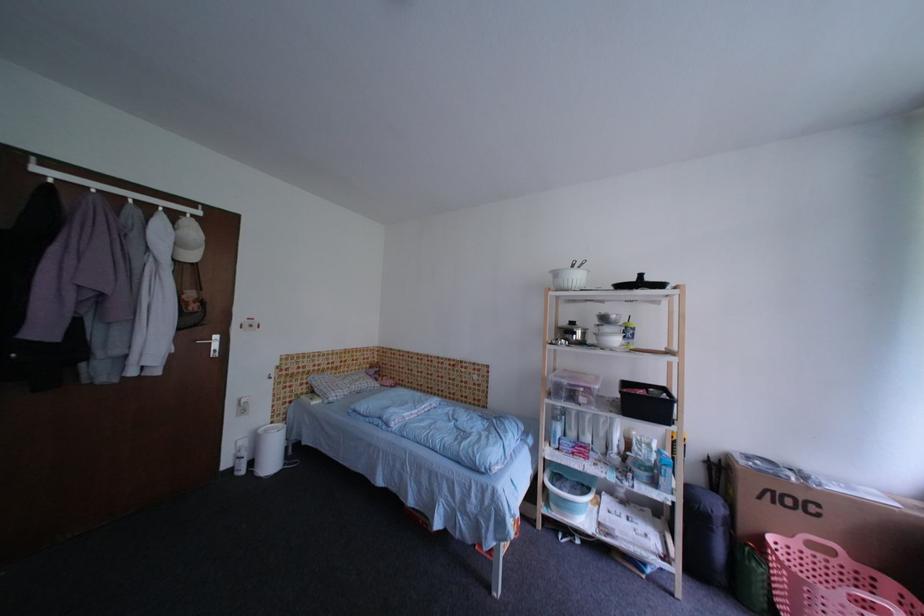
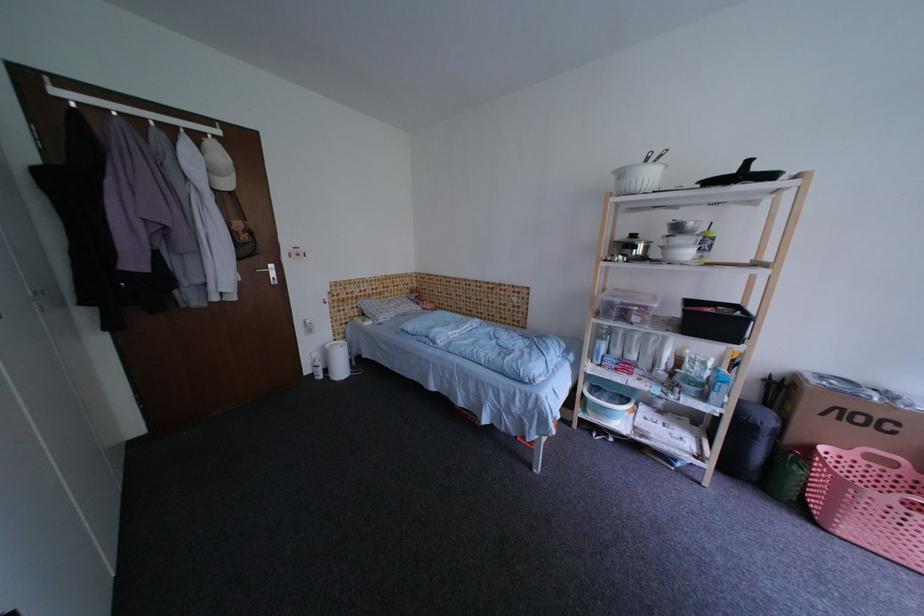
Where in the second image is the point corresponding to (819,546) from the first image?

(878, 459)